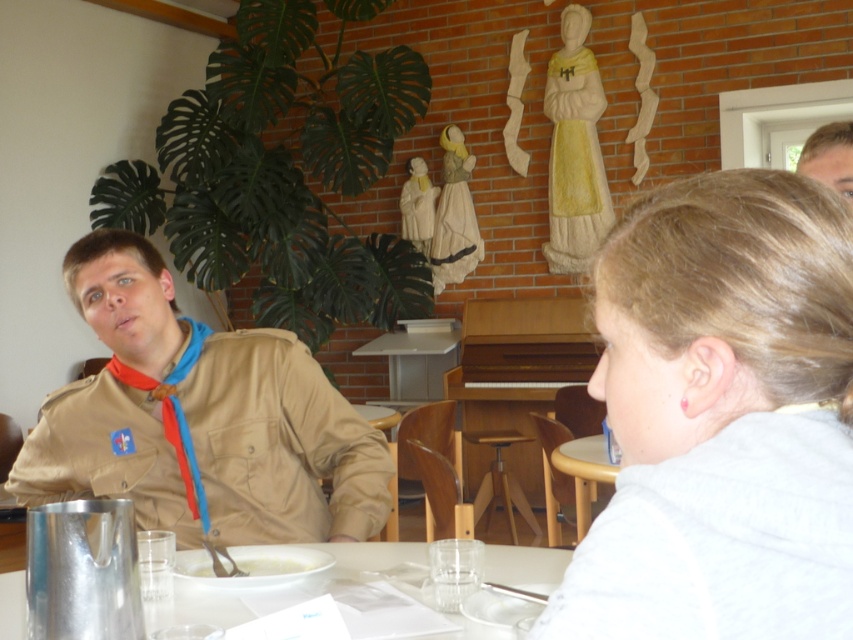
Question: Estimate the real-world distances between objects in this image. Which object is farther from the wooden table at center?

Choices:
 (A) white creamy soup at lower center
 (B) light brown hair at upper right
 (C) clear plastic table at lower center

Answer: (B)

Question: Can you confirm if wooden table at center is wider than white creamy soup at lower center?

Choices:
 (A) yes
 (B) no

Answer: (A)

Question: Based on their relative distances, which object is nearer to the clear plastic table at lower center?

Choices:
 (A) white creamy soup at lower center
 (B) red fabric lanyard at left

Answer: (A)

Question: Is tan uniform at center behind white creamy soup at lower center?

Choices:
 (A) yes
 (B) no

Answer: (A)

Question: Considering the real-world distances, which object is closest to the light brown hair at upper right?

Choices:
 (A) wooden table at center
 (B) white creamy soup at lower center
 (C) clear plastic table at lower center

Answer: (C)

Question: Is light brown hair at upper right below red fabric lanyard at left?

Choices:
 (A) no
 (B) yes

Answer: (A)